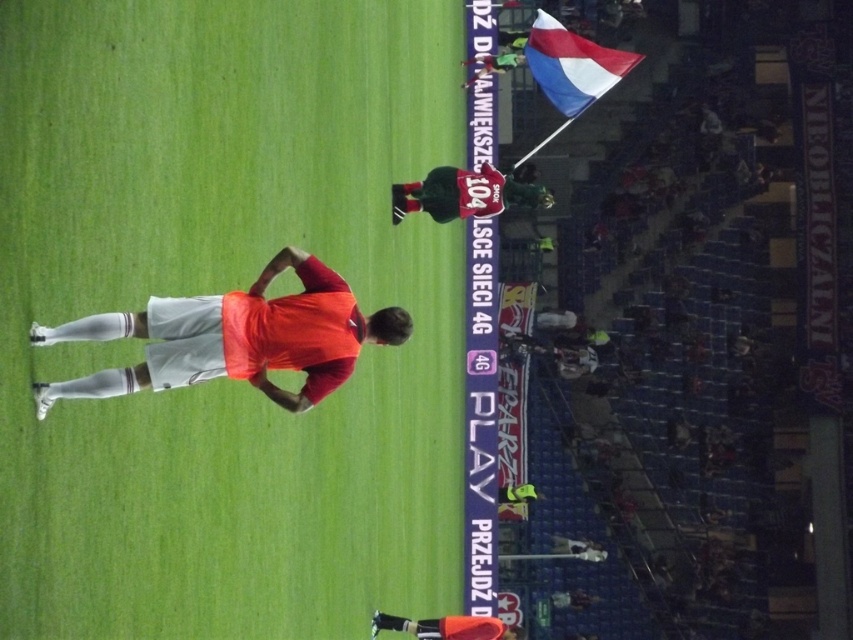
Where is the matte orange shirt at center located in the image?

The matte orange shirt at center is located at point (236, 337).

You are a photographer positioned at the center of the soccer field. You want to take a photo that includes both the red and white fabric flag at upper right and the orange matte shorts at lower center. Which object should you adjust your camera angle to focus on first to ensure both are in frame?

You should focus on the orange matte shorts at lower center first because the red and white fabric flag at upper right is closer to you, so adjusting for the shorts ensures both are in frame.

You are a soccer player positioned at the center of the field. You see two points marked on the field, point 1 at coordinates (231,316) and point 2 at (515,636). Which point is closer to you?

Point 1 at coordinates (231,316) is closer to the viewer than point 2 at (515,636).